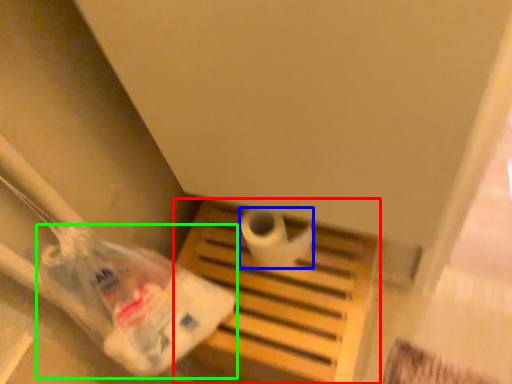
Question: Which is farther away from furniture (highlighted by a red box)? toilet paper (highlighted by a blue box) or plastic bag (highlighted by a green box)?

Choices:
 (A) toilet paper
 (B) plastic bag

Answer: (B)